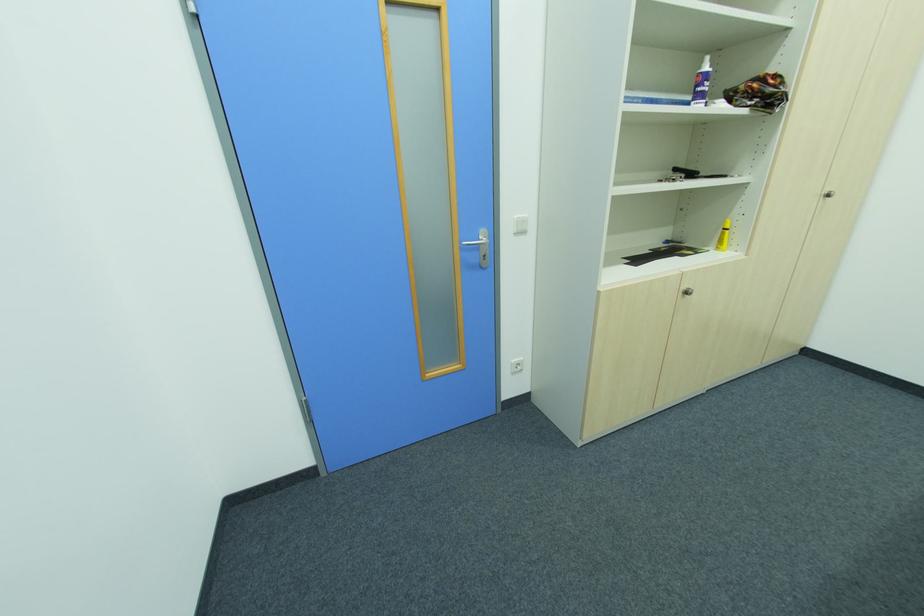
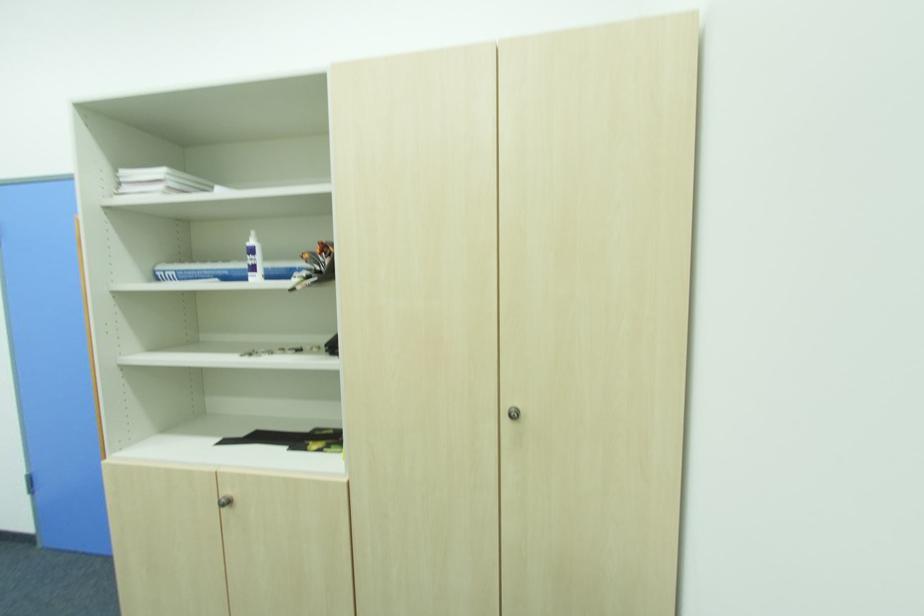
Where in the second image is the point corresponding to the point at 689,294 from the first image?

(229, 504)